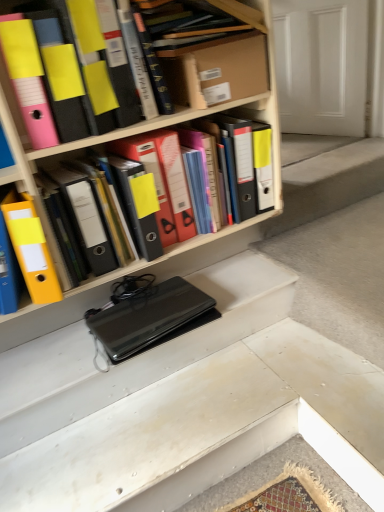
Question: Relative to hardcover book at upper center, the 2th book viewed from the right, is yellow matte ring binder at center in front or behind?

Choices:
 (A) front
 (B) behind

Answer: (A)

Question: Is yellow matte ring binder at center wider or thinner than hardcover book at upper center, the 2th book viewed from the right?

Choices:
 (A) wide
 (B) thin

Answer: (B)

Question: Estimate the real-world distances between objects in this image. Which object is closer to the hardcover book at upper center, the 2th book viewed from the right?

Choices:
 (A) cardboard box at upper center
 (B) wooden book at upper center, the third book positioned from the left
 (C) matte black binder at upper left, arranged as the first book when viewed from the left
 (D) yellow matte ring binder at center
 (E) black matte laptop at center

Answer: (B)

Question: Considering the real-world distances, which object is farthest from the hardcover book at upper center, the 2th book viewed from the right?

Choices:
 (A) wooden book at upper center, the third book positioned from the left
 (B) white matte door at upper right
 (C) cardboard box at upper center
 (D) yellow matte ring binder at center
 (E) matte black binder at upper left, arranged as the first book when viewed from the left

Answer: (B)